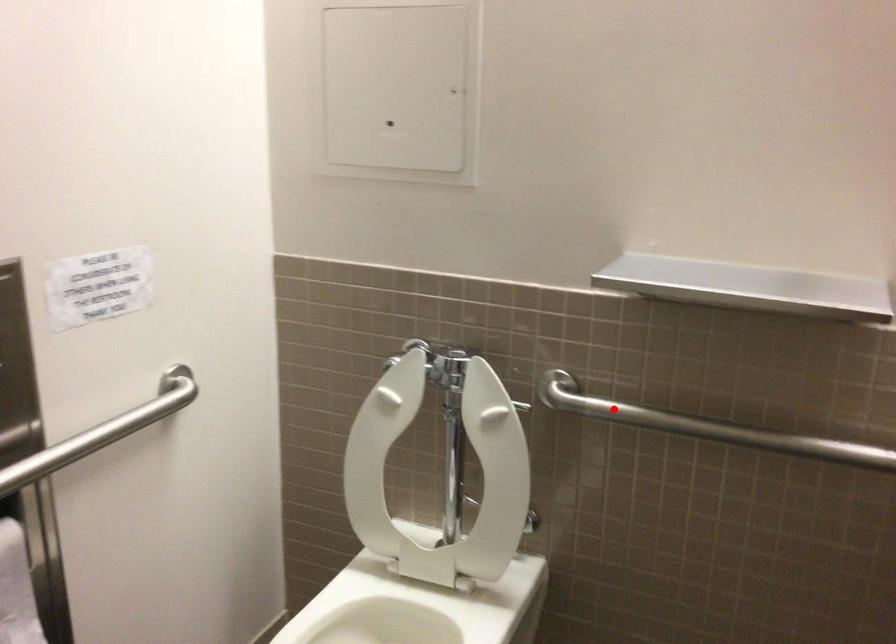
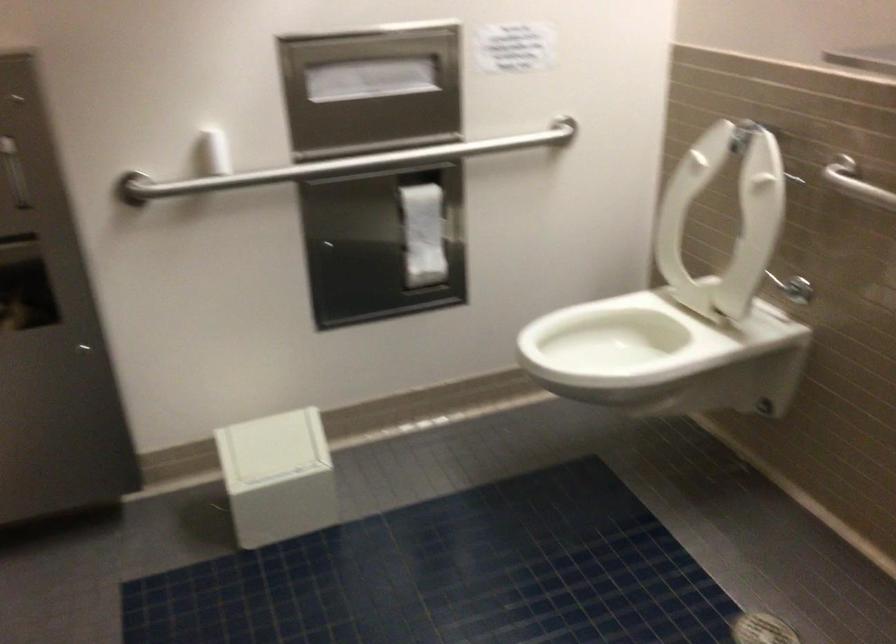
Question: I am providing you with two images of the same scene from different viewpoints. Given a red point in image1, look at the same physical point in image2. Is it:

Choices:
 (A) Closer to the viewpoint
 (B) Farther from the viewpoint

Answer: (B)